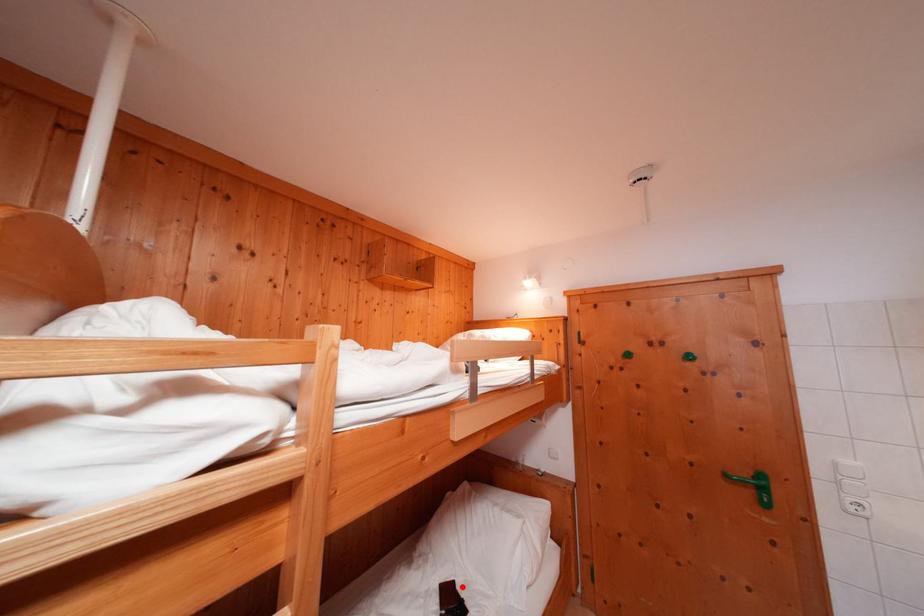
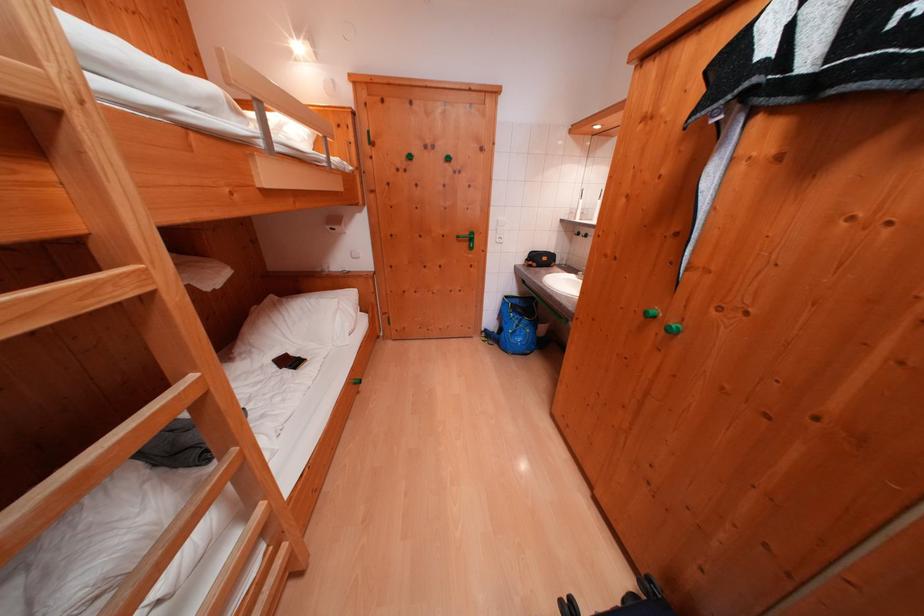
Question: I am providing you with two images of the same scene from different viewpoints. A red point is marked on the first image. Is the red point's position out of view in image 2?

Choices:
 (A) Yes
 (B) No

Answer: (B)